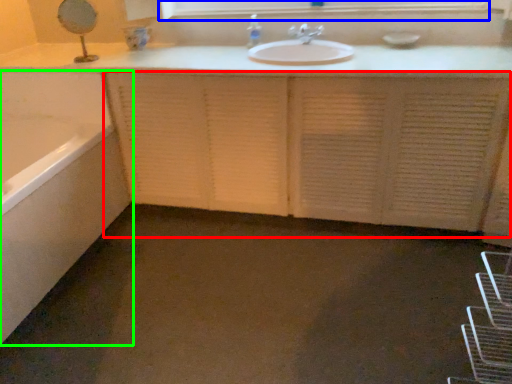
Question: Which object is positioned closest to cabinetry (highlighted by a red box)? Select from medicine cabinet (highlighted by a blue box) and bathtub (highlighted by a green box).

Choices:
 (A) medicine cabinet
 (B) bathtub

Answer: (B)